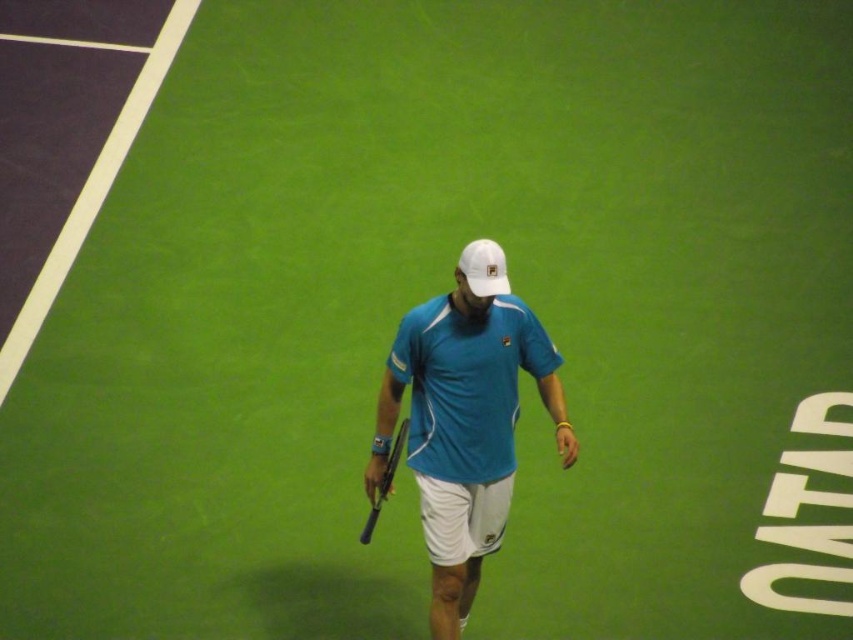
Can you confirm if blue fabric shirt at center is wider than black matte tennis racket at center?

Correct, the width of blue fabric shirt at center exceeds that of black matte tennis racket at center.

Can you confirm if blue fabric shirt at center is shorter than black matte tennis racket at center?

No, blue fabric shirt at center is not shorter than black matte tennis racket at center.

Between point (454, 557) and point (380, 493), which one is positioned behind?

The point (380, 493) is behind.

What are the coordinates of `blue fabric shirt at center` in the screenshot? It's located at (467, 419).

Can you confirm if black matte tennis racket at center is positioned below black rubber tennis racket at center?

Yes, black matte tennis racket at center is below black rubber tennis racket at center.

Which of these two, black matte tennis racket at center or black rubber tennis racket at center, stands taller?

black matte tennis racket at center

Is point (405, 433) behind point (372, 484)?

Yes, point (405, 433) is behind point (372, 484).

Locate an element on the screen. Image resolution: width=853 pixels, height=640 pixels. black matte tennis racket at center is located at coordinates (384, 481).

Which is in front, point (428, 317) or point (376, 474)?

Point (428, 317) is in front.

Measure the distance between blue fabric shirt at center and black rubber tennis racket at center.

blue fabric shirt at center and black rubber tennis racket at center are 19.86 inches apart.

Locate an element on the screen. The width and height of the screenshot is (853, 640). blue fabric shirt at center is located at coordinates (467, 419).

At what (x,y) coordinates should I click in order to perform the action: click on blue fabric shirt at center. Please return your answer as a coordinate pair (x, y). The width and height of the screenshot is (853, 640). Looking at the image, I should click on (467, 419).